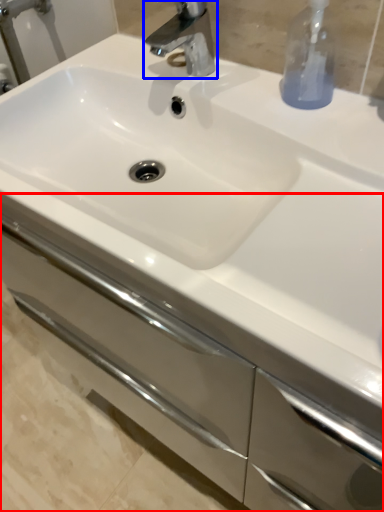
Question: Which object appears closest to the camera in this image, bathroom cabinet (highlighted by a red box) or tap (highlighted by a blue box)?

Choices:
 (A) bathroom cabinet
 (B) tap

Answer: (A)